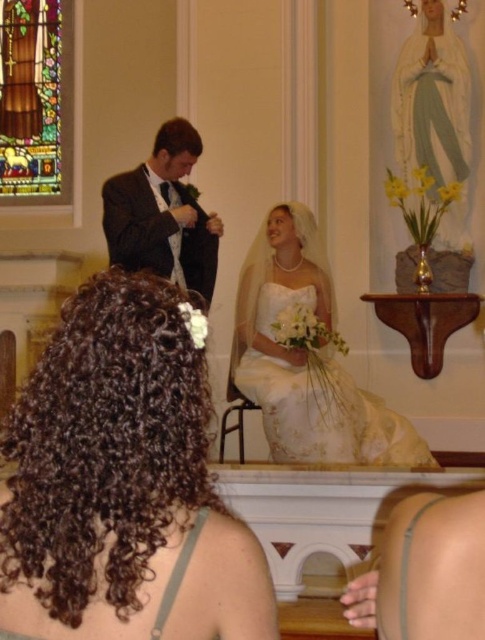
You are a photographer at a wedding and need to capture a shot that includes both the stained glass at upper left and the matte black suit at center. Given their sizes, which object should you frame first to ensure both are visible in the photo?

The stained glass at upper left is larger than the matte black suit at center, so you should frame the stained glass at upper left first to accommodate its size, then adjust the shot to include the matte black suit at center.

In the church wedding scene, there are a white satin dress at center and a matte black suit at center. Which one takes up more space in the image?

The white satin dress at center is bigger than the matte black suit at center, so it takes up more space in the image.